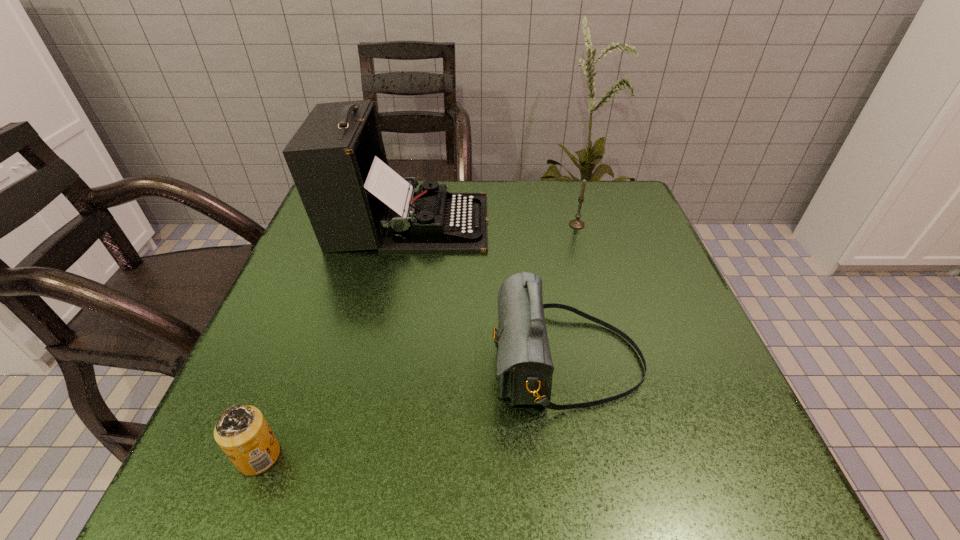
You are a GUI agent. You are given a task and a screenshot of the screen. Output one action in this format:
    pyautogui.click(x=<x>, y=<y>)
    Task: Click on the free space between the third shortest object and the beer can
    The width and height of the screenshot is (960, 540).
    Given the screenshot: What is the action you would take?
    pyautogui.click(x=413, y=409)

Where is `free space between the candle and the nearest object`? free space between the candle and the nearest object is located at coordinates (418, 340).

You are a GUI agent. You are given a task and a screenshot of the screen. Output one action in this format:
    pyautogui.click(x=<x>, y=<y>)
    Task: Click on the vacant area between the third shortest object and the beer can
    Image resolution: width=960 pixels, height=540 pixels.
    Given the screenshot: What is the action you would take?
    pyautogui.click(x=413, y=409)

Where is `free space between the shortest object and the third shortest object`? Image resolution: width=960 pixels, height=540 pixels. free space between the shortest object and the third shortest object is located at coordinates (413, 409).

You are a GUI agent. You are given a task and a screenshot of the screen. Output one action in this format:
    pyautogui.click(x=<x>, y=<y>)
    Task: Click on the empty location between the candle and the second nearest object
    The height and width of the screenshot is (540, 960).
    Given the screenshot: What is the action you would take?
    pyautogui.click(x=572, y=293)

This screenshot has width=960, height=540. I want to click on unoccupied area between the tallest object and the second tallest object, so click(488, 292).

You are a GUI agent. You are given a task and a screenshot of the screen. Output one action in this format:
    pyautogui.click(x=<x>, y=<y>)
    Task: Click on the object that is the closest to the candle
    
    Given the screenshot: What is the action you would take?
    pyautogui.click(x=354, y=201)

Identify which object is the second nearest to the shoulder bag. Please provide its 2D coordinates. Your answer should be formatted as a tuple, i.e. [(x, y)], where the tuple contains the x and y coordinates of a point satisfying the conditions above.

[(575, 223)]

Where is `blank space that satisfies the following two spatial constraints: 1. on the back side of the third farthest object; 2. on the right side of the third tallest object`? blank space that satisfies the following two spatial constraints: 1. on the back side of the third farthest object; 2. on the right side of the third tallest object is located at coordinates tap(542, 225).

Locate an element on the screen. The image size is (960, 540). vacant space that satisfies the following two spatial constraints: 1. on the back side of the beer can; 2. on the right side of the candle is located at coordinates (348, 225).